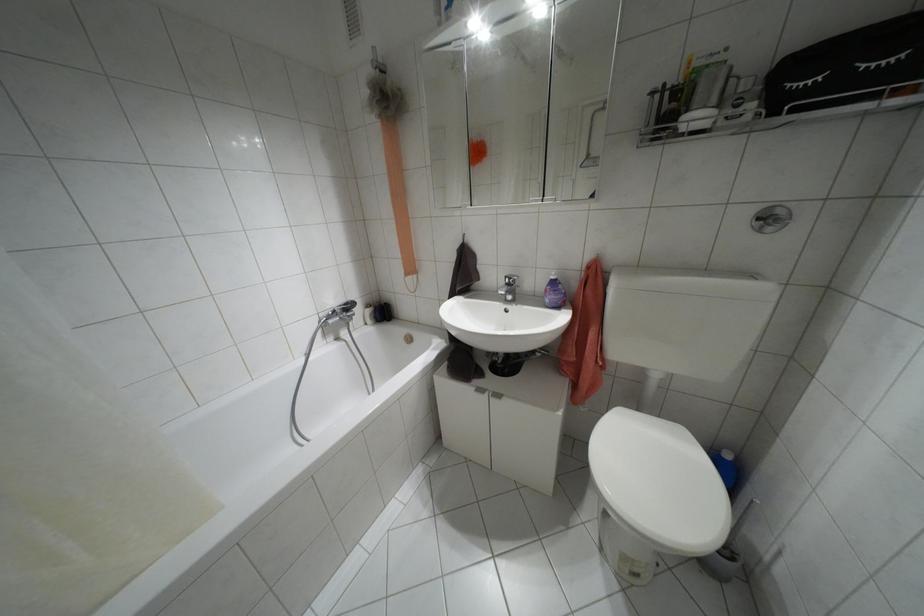
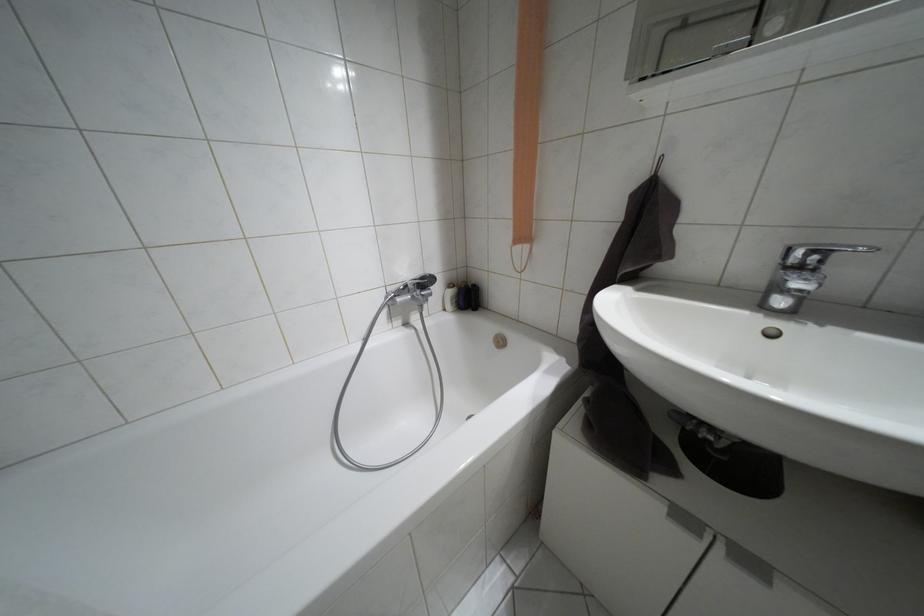
In the second image, find the point that corresponds to (508,278) in the first image.

(810, 253)